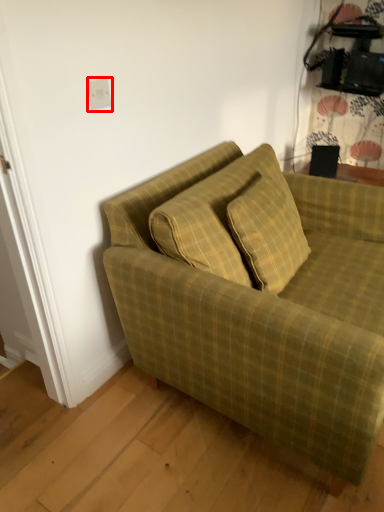
Question: Observing the image, what is the correct spatial positioning of electric outlet (annotated by the red box) in reference to studio couch?

Choices:
 (A) right
 (B) left

Answer: (B)